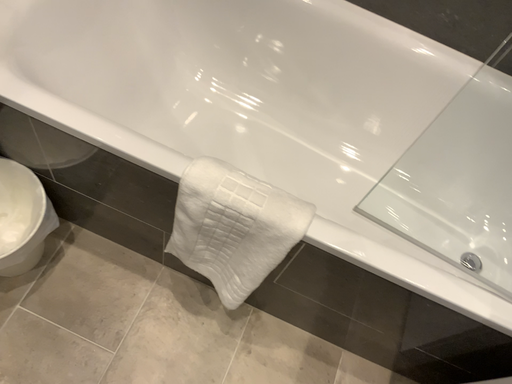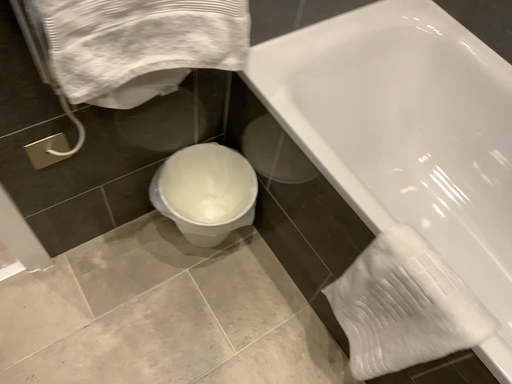
Question: Which way did the camera rotate in the video?

Choices:
 (A) rotated right
 (B) rotated left

Answer: (B)